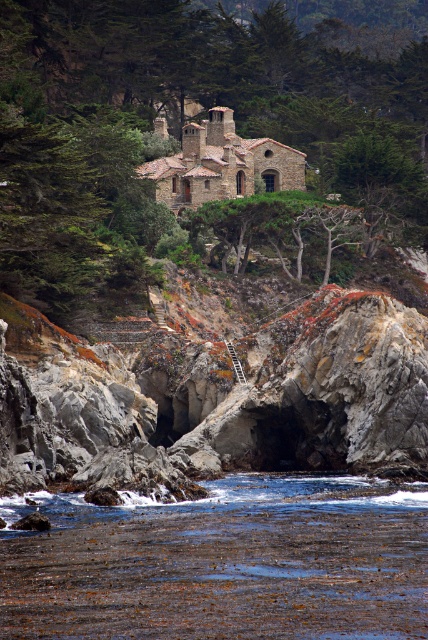
Question: Is green leafy tree at upper center smaller than brown seaweed at lower center?

Choices:
 (A) yes
 (B) no

Answer: (B)

Question: Is green leafy tree at upper center bigger than brown seaweed at lower center?

Choices:
 (A) yes
 (B) no

Answer: (A)

Question: Is green leafy tree at upper center positioned behind brown seaweed at lower center?

Choices:
 (A) no
 (B) yes

Answer: (B)

Question: Which point is farther to the camera?

Choices:
 (A) (238, 556)
 (B) (255, 115)

Answer: (B)

Question: Which object is closer to the camera taking this photo?

Choices:
 (A) green leafy tree at upper center
 (B) brown seaweed at lower center

Answer: (B)